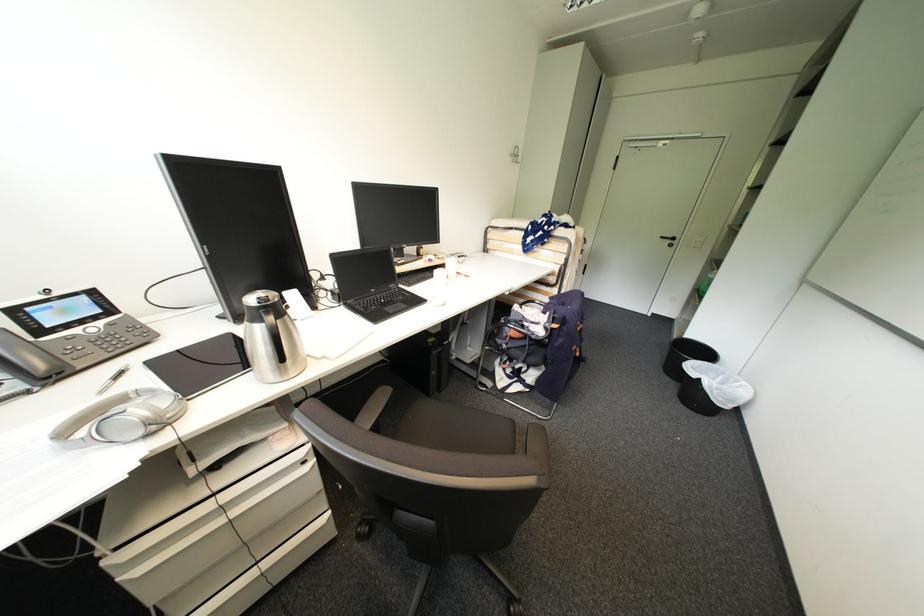
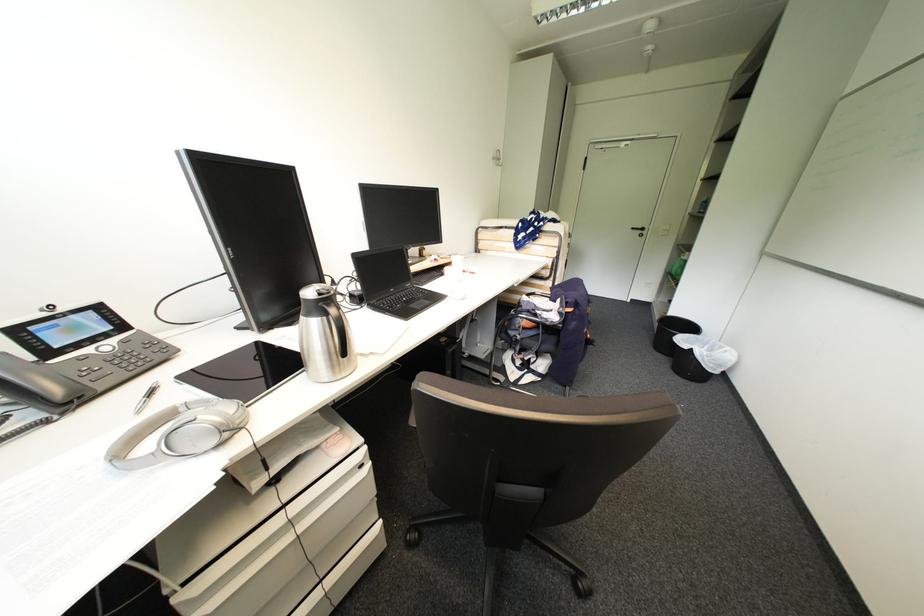
The point at (x=270, y=293) is marked in the first image. Where is the corresponding point in the second image?

(324, 286)